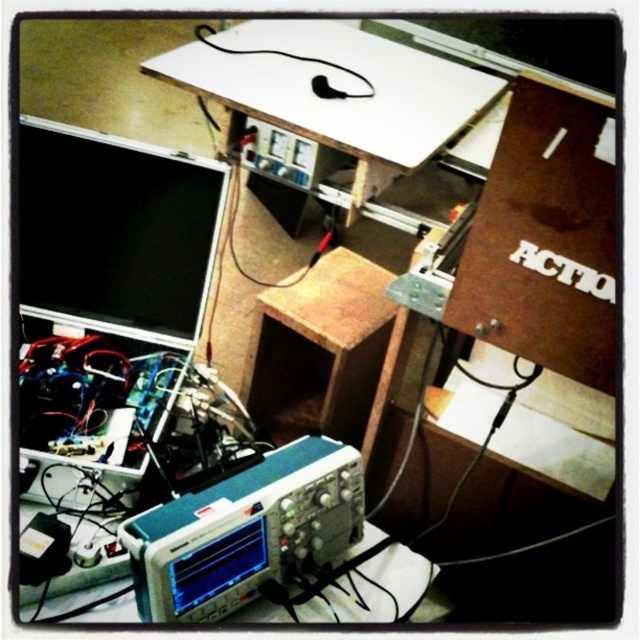
You are an engineer who needs to connect the black rubber wire at upper center to the black matte computer monitor at upper left. Given that the wire is 28 inches long, will it reach the monitor without needing to be extended?

The black matte computer monitor at upper left and black rubber wire at upper center are 28.79 inches apart. Since the wire is only 28 inches long, it is 0.79 inches shorter than the required distance. Therefore, the wire will not reach the monitor without extension.

You are an engineer working on an electronics project and need to identify the relative positions of two points on your oscilloscope screen. The first point is at coordinates point (x=186, y=221) and the second point is at point (x=317, y=508). Based on the oscilloscope display, which point is closer to the viewer?

Point (x=186, y=221) is behind point (x=317, y=508), so the point (x=317, y=508) is closer to the viewer.